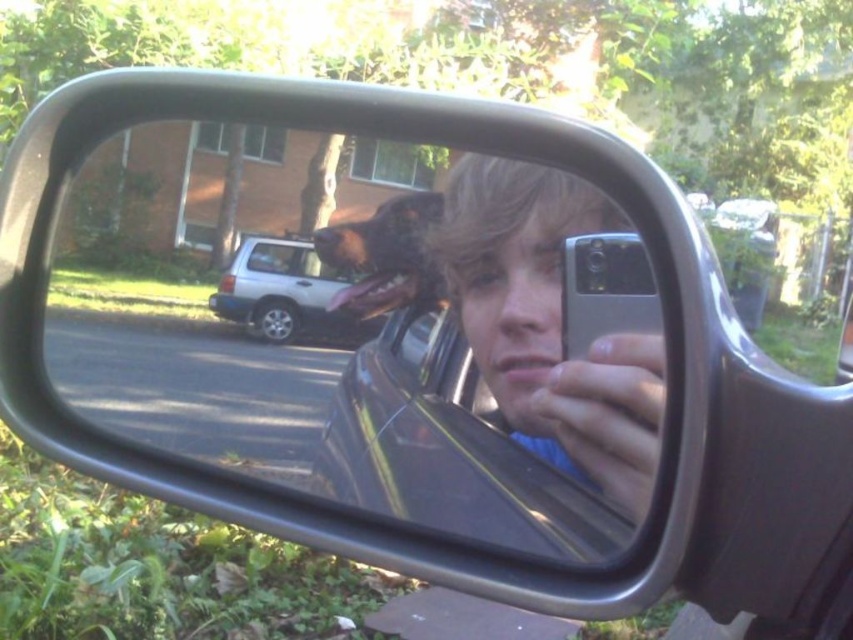
Is white matte suv at center taller than clear glass car window at center?

Indeed, white matte suv at center has a greater height compared to clear glass car window at center.

Who is taller, white matte suv at center or clear glass car window at center?

With more height is white matte suv at center.

Measure the distance between point (309, 272) and camera.

Point (309, 272) is 19.85 inches from camera.

The image size is (853, 640). I want to click on white matte suv at center, so click(283, 292).

Which is in front, point (305, 326) or point (318, 243)?

Point (318, 243)

The image size is (853, 640). What do you see at coordinates (283, 292) in the screenshot?
I see `white matte suv at center` at bounding box center [283, 292].

Who is more forward, (328, 332) or (415, 298)?

Point (415, 298) is more forward.

Where is `white matte suv at center`? The image size is (853, 640). white matte suv at center is located at coordinates (283, 292).

Consider the image. Is matte silver phone at center positioned behind white matte suv at center?

No, it is in front of white matte suv at center.

Does matte silver phone at center appear on the right side of white matte suv at center?

Indeed, matte silver phone at center is positioned on the right side of white matte suv at center.

Image resolution: width=853 pixels, height=640 pixels. What do you see at coordinates (548, 323) in the screenshot?
I see `matte silver phone at center` at bounding box center [548, 323].

Where is `matte silver phone at center`? This screenshot has height=640, width=853. matte silver phone at center is located at coordinates (548, 323).